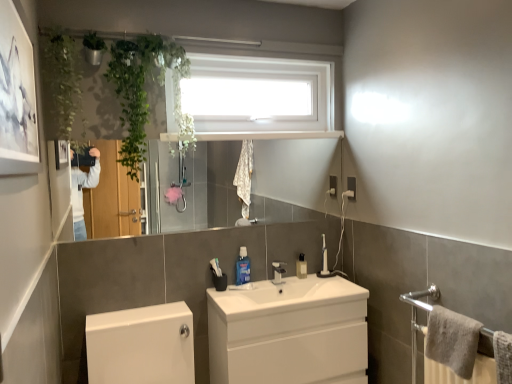
Question: Is white plastic tap at center to the left of blue glossy mouthwash at center, which appears as the second toiletry when viewed from the back, from the viewer's perspective?

Choices:
 (A) no
 (B) yes

Answer: (A)

Question: From the image's perspective, does white plastic tap at center appear higher than blue glossy mouthwash at center, which ranks as the 2th toiletry in right-to-left order?

Choices:
 (A) no
 (B) yes

Answer: (A)

Question: Are white plastic tap at center and blue glossy mouthwash at center, which appears as the second toiletry when viewed from the back, located far from each other?

Choices:
 (A) yes
 (B) no

Answer: (B)

Question: From a real-world perspective, is white plastic tap at center positioned under blue glossy mouthwash at center, which ranks as the 2th toiletry in right-to-left order, based on gravity?

Choices:
 (A) yes
 (B) no

Answer: (A)

Question: Is white plastic tap at center positioned beyond the bounds of blue glossy mouthwash at center, which ranks as the 2th toiletry in right-to-left order?

Choices:
 (A) yes
 (B) no

Answer: (A)

Question: Is white plastic tap at center further to the viewer compared to blue glossy mouthwash at center, the first toiletry viewed from the left?

Choices:
 (A) yes
 (B) no

Answer: (A)

Question: Is translucent plastic bottle at center, which is the second toiletry from front to back, a part of green leafy plant at upper left?

Choices:
 (A) no
 (B) yes

Answer: (A)

Question: Considering the relative sizes of green leafy plant at upper left and translucent plastic bottle at center, which is the 1th toiletry in right-to-left order, in the image provided, is green leafy plant at upper left taller than translucent plastic bottle at center, which is the 1th toiletry in right-to-left order,?

Choices:
 (A) yes
 (B) no

Answer: (A)

Question: Is green leafy plant at upper left looking in the opposite direction of translucent plastic bottle at center, which is the second toiletry from front to back?

Choices:
 (A) yes
 (B) no

Answer: (B)

Question: Does green leafy plant at upper left have a lesser height compared to translucent plastic bottle at center, the second toiletry positioned from the left?

Choices:
 (A) no
 (B) yes

Answer: (A)

Question: Is green leafy plant at upper left positioned before translucent plastic bottle at center, which is the 1th toiletry in right-to-left order?

Choices:
 (A) no
 (B) yes

Answer: (B)

Question: Can you confirm if green leafy plant at upper left is wider than translucent plastic bottle at center, which is the second toiletry from front to back?

Choices:
 (A) yes
 (B) no

Answer: (A)

Question: From the image's perspective, is white glossy toilet at lower left over translucent plastic bottle at center, which is the 1th toiletry in right-to-left order?

Choices:
 (A) no
 (B) yes

Answer: (A)